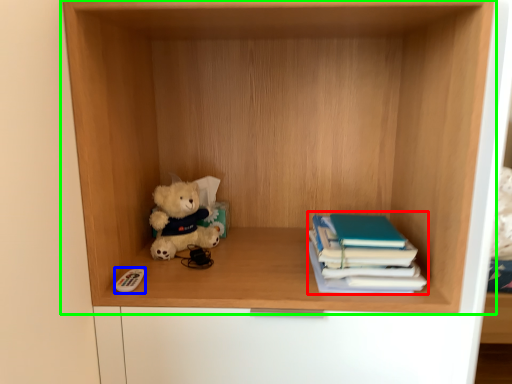
Question: Based on their relative distances, which object is farther from book (highlighted by a red box)? Choose from toy (highlighted by a blue box) and shelf (highlighted by a green box).

Choices:
 (A) toy
 (B) shelf

Answer: (A)